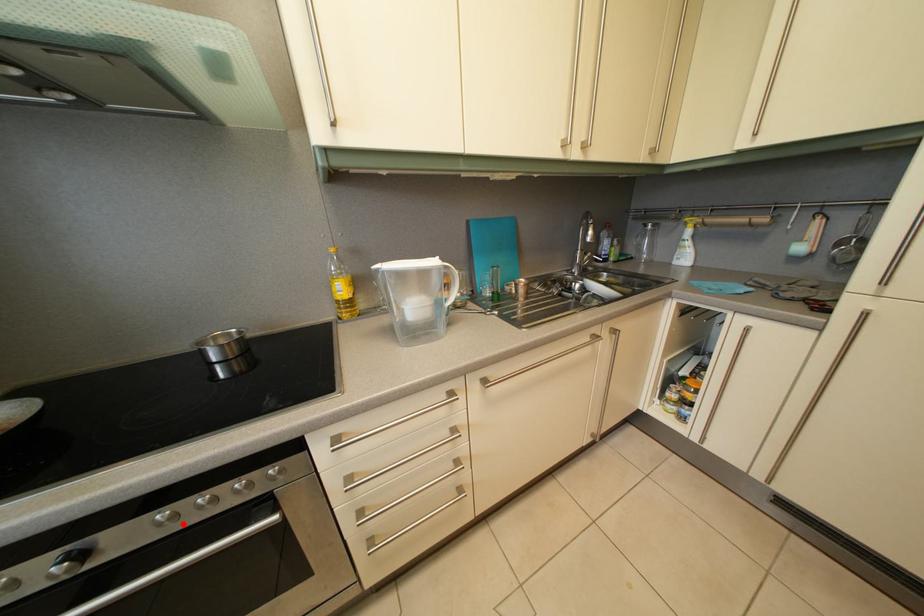
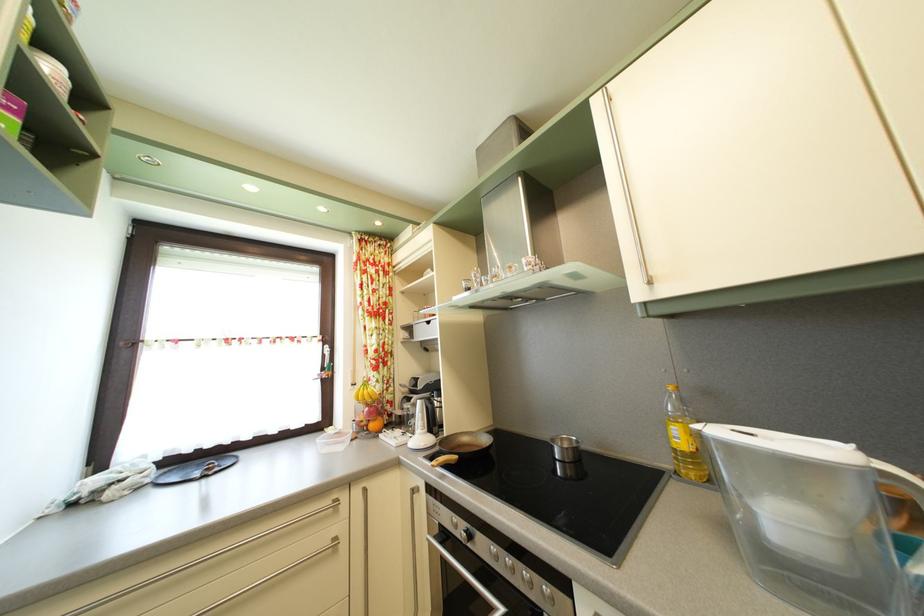
Question: I am providing you with two images of the same scene from different viewpoints. A red point is marked on the first image. Is the red point's position out of view in image 2?

Choices:
 (A) Yes
 (B) No

Answer: (B)